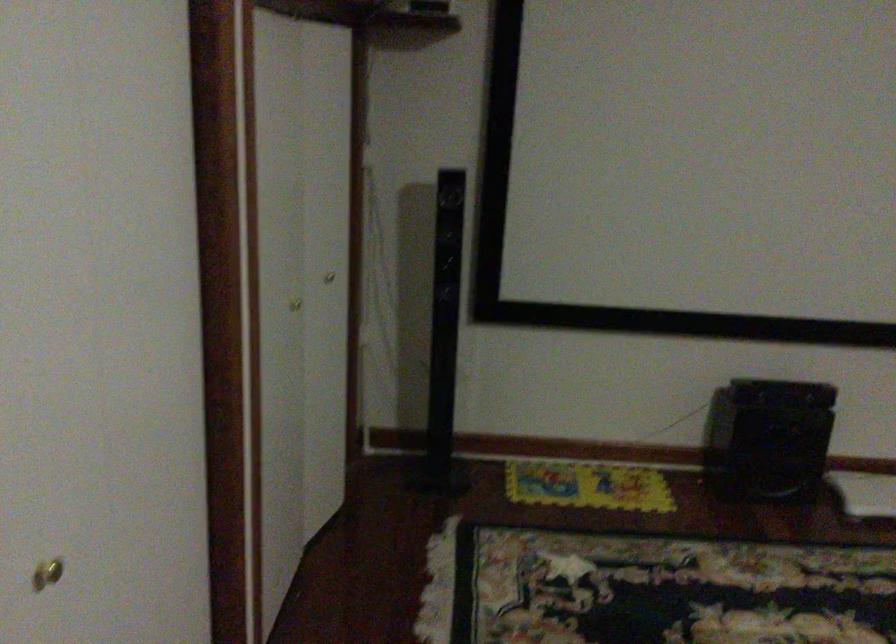
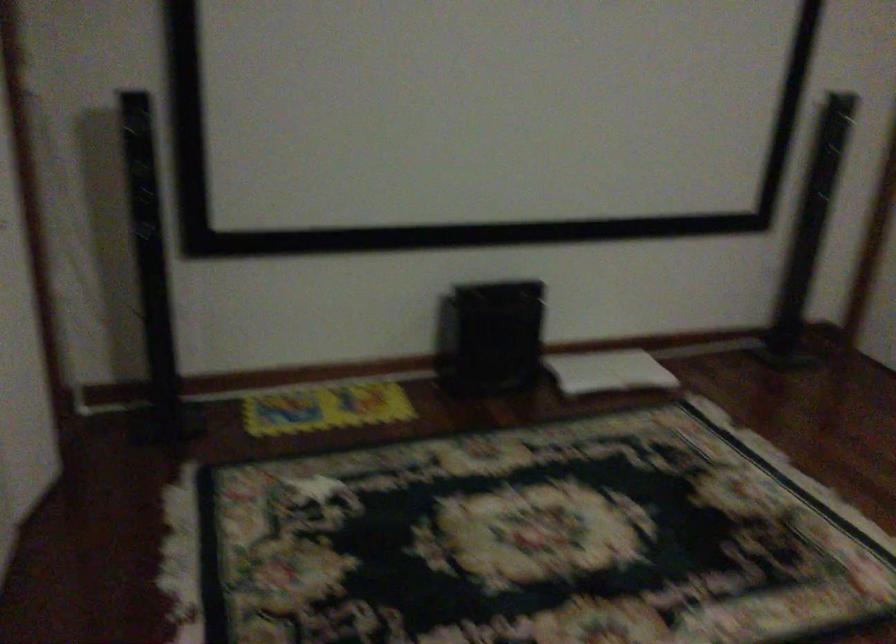
Question: How did the camera likely rotate?

Choices:
 (A) Left
 (B) Right
 (C) Up
 (D) Down

Answer: (B)